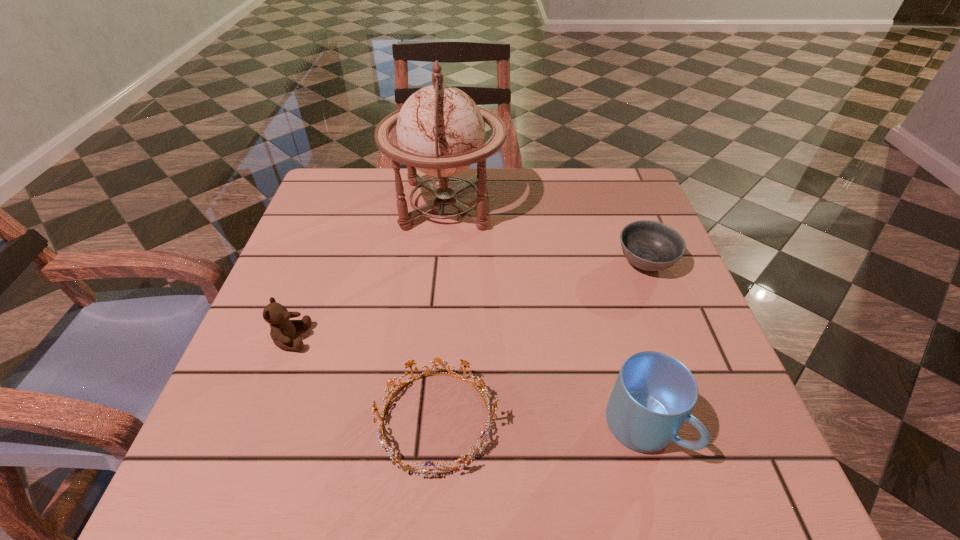
This screenshot has width=960, height=540. Identify the location of empty space that is in between the globe and the second tallest object. (544, 316).

Image resolution: width=960 pixels, height=540 pixels. Find the location of `vacant area between the bowl and the tiara`. vacant area between the bowl and the tiara is located at coordinates (540, 341).

You are a GUI agent. You are given a task and a screenshot of the screen. Output one action in this format:
    pyautogui.click(x=<x>, y=<y>)
    Task: Click on the vacant area that lies between the tiara and the teddy bear
    The width and height of the screenshot is (960, 540).
    Given the screenshot: What is the action you would take?
    pyautogui.click(x=364, y=379)

Find the location of a particular element. Image resolution: width=960 pixels, height=540 pixels. object that stands as the closest to the third farthest object is located at coordinates (463, 461).

Select which object is the second closest to the tiara. Please provide its 2D coordinates. Your answer should be formatted as a tuple, i.e. [(x, y)], where the tuple contains the x and y coordinates of a point satisfying the conditions above.

[(654, 394)]

This screenshot has height=540, width=960. Find the location of `vacant space that satisfies the following two spatial constraints: 1. at the front of the tallest object showing Africa; 2. on the left side of the fourth shortest object`. vacant space that satisfies the following two spatial constraints: 1. at the front of the tallest object showing Africa; 2. on the left side of the fourth shortest object is located at coordinates (425, 427).

Locate an element on the screen. The image size is (960, 540). free region that satisfies the following two spatial constraints: 1. on the front-facing side of the tiara; 2. on the left side of the mug is located at coordinates (436, 427).

I want to click on free location that satisfies the following two spatial constraints: 1. on the front-facing side of the third shortest object; 2. on the back side of the second tallest object, so click(x=257, y=427).

I want to click on vacant space that satisfies the following two spatial constraints: 1. on the front-facing side of the teddy bear; 2. on the right side of the mug, so click(257, 427).

Image resolution: width=960 pixels, height=540 pixels. I want to click on vacant space that satisfies the following two spatial constraints: 1. on the back side of the second tallest object; 2. at the front of the tallest object showing Africa, so click(582, 205).